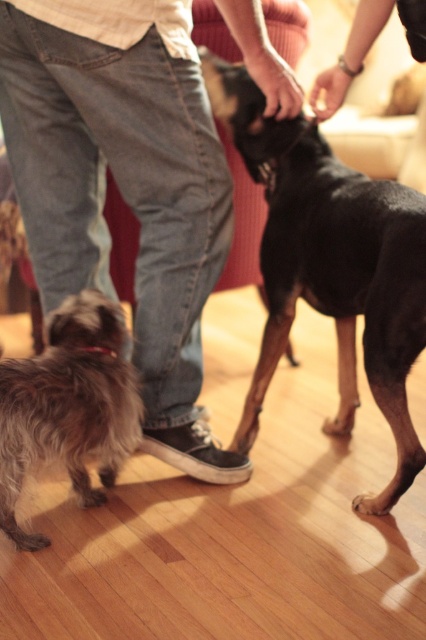
Question: Among these points, which one is nearest to the camera?

Choices:
 (A) (25, 115)
 (B) (14, 461)

Answer: (B)

Question: Is jeans at center further to camera compared to fuzzy brown dog at lower left?

Choices:
 (A) yes
 (B) no

Answer: (B)

Question: Is jeans at center behind fuzzy brown dog at lower left?

Choices:
 (A) yes
 (B) no

Answer: (B)

Question: Is jeans at center bigger than fuzzy brown dog at lower left?

Choices:
 (A) yes
 (B) no

Answer: (A)

Question: Which of these objects is positioned farthest from the jeans at center?

Choices:
 (A) black smooth dog at center
 (B) fuzzy brown dog at lower left

Answer: (A)

Question: Which object appears closest to the camera in this image?

Choices:
 (A) jeans at center
 (B) fuzzy brown dog at lower left

Answer: (A)